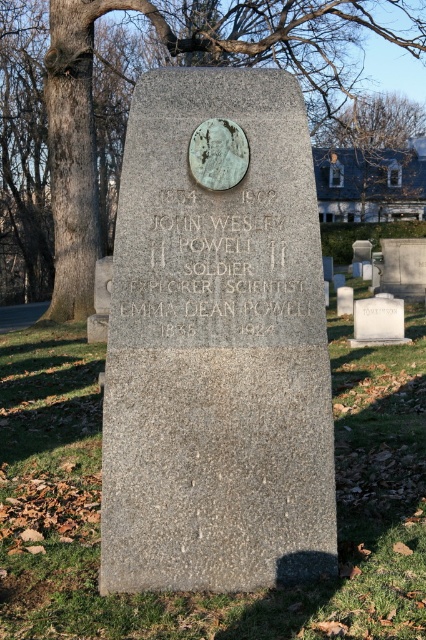
You are a groundskeeper at the cemetery and need to place a new flowerpot between the bronze plaque at center and the white marble gravestone at center. Which object should you place the flowerpot closer to if you want it to be near the wider object?

The bronze plaque at center is wider than the white marble gravestone at center, so you should place the flowerpot closer to the bronze plaque at center.

You are standing in a cemetery and want to locate the granite gravestone at center. What are the coordinates where you should look?

The granite gravestone at center is located at coordinates point (216, 342).